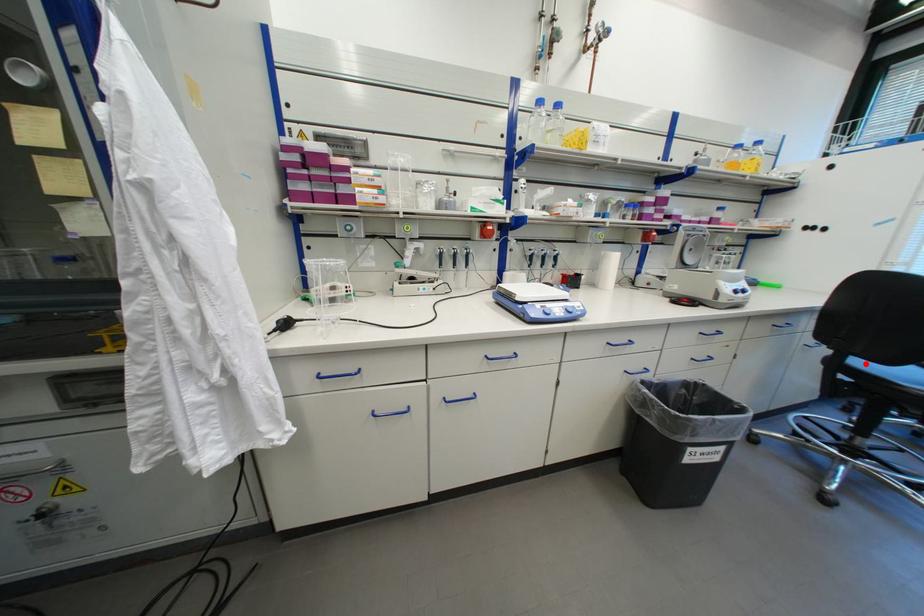
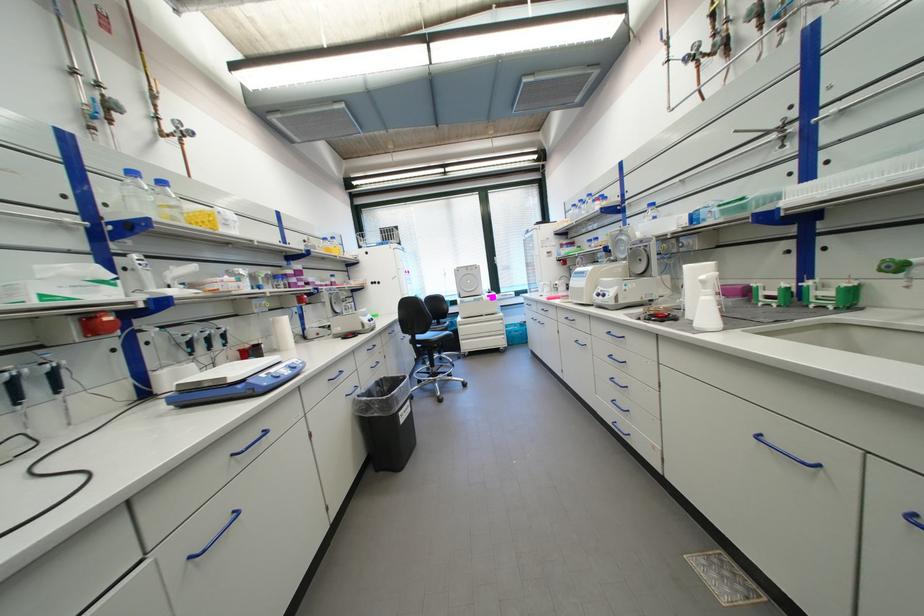
Question: I am providing you with two images of the same scene from different viewpoints. A red point is marked on the first image. Is the red point's position out of view in image 2?

Choices:
 (A) Yes
 (B) No

Answer: (B)